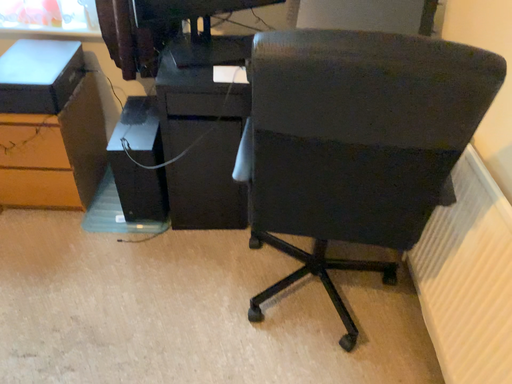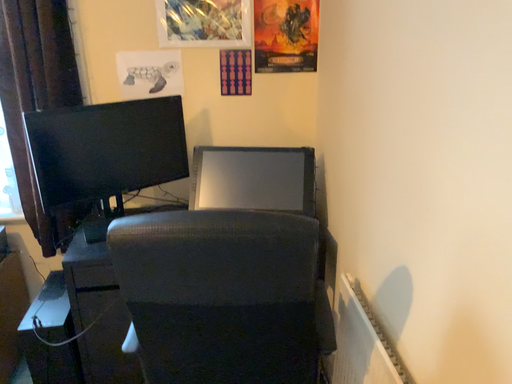
Question: Which way did the camera rotate in the video?

Choices:
 (A) rotated upward
 (B) rotated downward

Answer: (A)